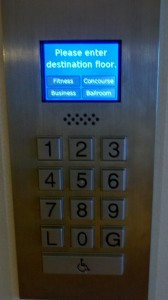
You are a GUI agent. You are given a task and a screenshot of the screen. Output one action in this format:
    pyautogui.click(x=<x>, y=<y>)
    Task: Click on the dark blue trim
    The height and width of the screenshot is (300, 168).
    Given the screenshot: What is the action you would take?
    pyautogui.click(x=118, y=55)